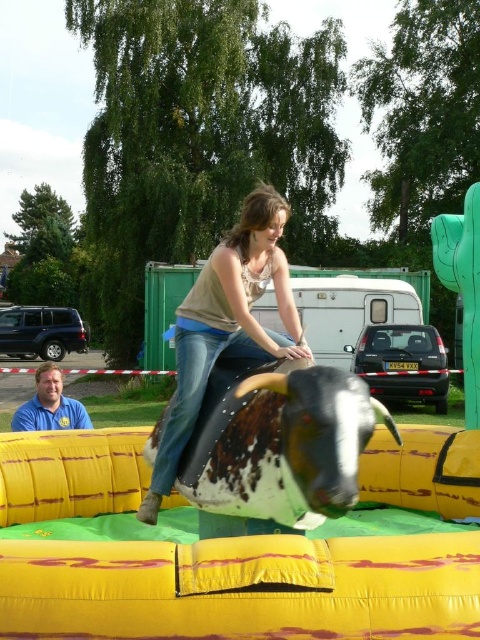
Does matte brown leather saddle at center have a larger size compared to blue shirt at lower left?

Actually, matte brown leather saddle at center might be smaller than blue shirt at lower left.

Does point (210, 360) come closer to viewer compared to point (20, 428)?

Yes, it is in front of point (20, 428).

Locate an element on the screen. This screenshot has height=640, width=480. matte brown leather saddle at center is located at coordinates (226, 324).

Can you confirm if brown textured bull at center is shorter than matte brown leather saddle at center?

Correct, brown textured bull at center is not as tall as matte brown leather saddle at center.

Who is more forward, (364,440) or (187,388)?

Point (364,440) is in front.

Where is `brown textured bull at center`? Image resolution: width=480 pixels, height=640 pixels. brown textured bull at center is located at coordinates (279, 442).

Who is more distant from viewer, (210, 488) or (31, 426)?

The point (31, 426) is more distant.

Who is lower down, brown textured bull at center or blue shirt at lower left?

blue shirt at lower left is below.

Is point (286, 476) in front of point (44, 376)?

Yes, point (286, 476) is closer to viewer.

The height and width of the screenshot is (640, 480). Find the location of `brown textured bull at center`. brown textured bull at center is located at coordinates (279, 442).